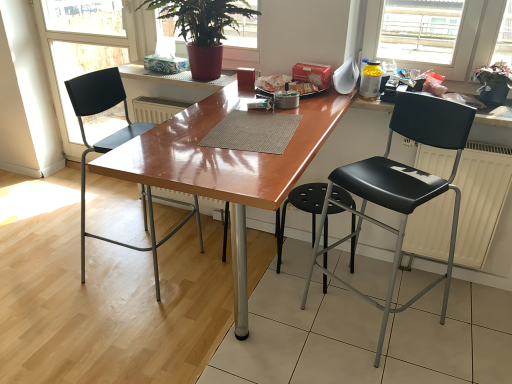
Find the location of a particular element. free space between glossy wood desk at center and black plastic chair at left, which is counted as the second chair, starting from the right is located at coordinates (162, 301).